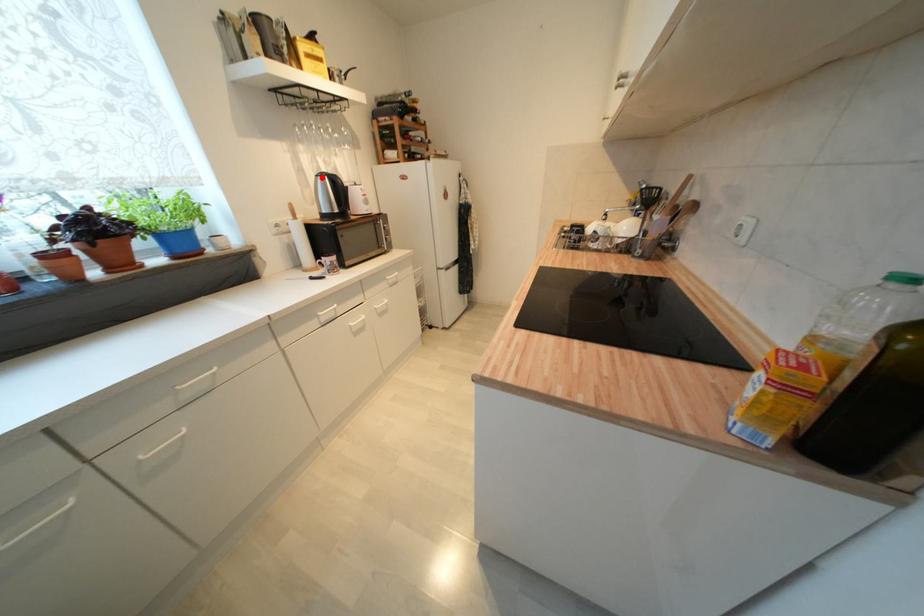
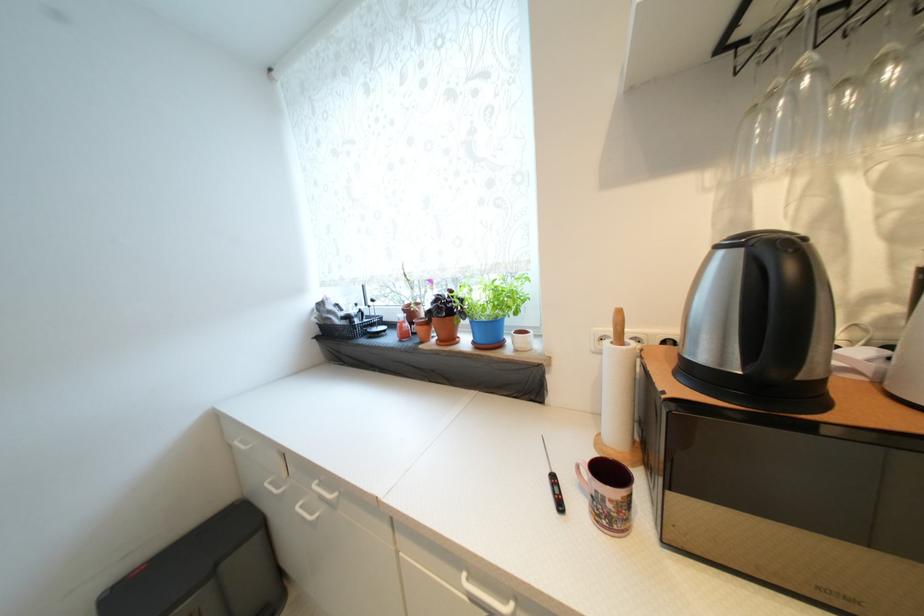
Where in the second image is the point corresponding to the highlighted location from the first image?

(723, 249)